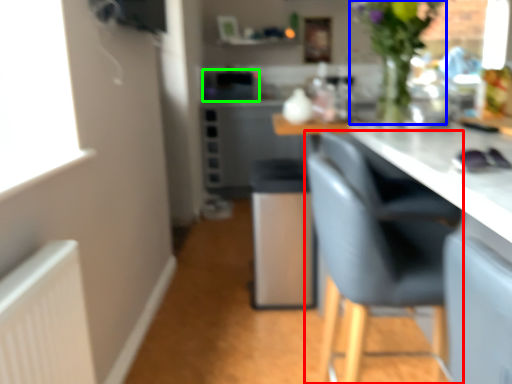
Question: Estimate the real-world distances between objects in this image. Which object is closer to chair (highlighted by a red box), floral arrangement (highlighted by a blue box) or appliance (highlighted by a green box)?

Choices:
 (A) floral arrangement
 (B) appliance

Answer: (A)